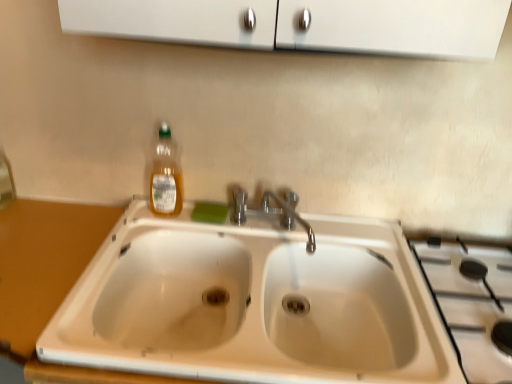
This screenshot has height=384, width=512. I want to click on vacant area on top of wooden counter at lower left (from a real-world perspective), so click(38, 251).